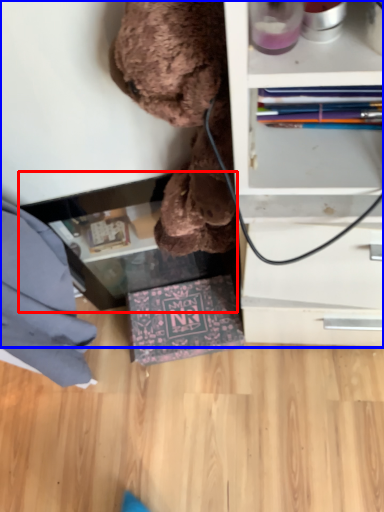
Question: Among these objects, which one is farthest to the camera, table (highlighted by a red box) or shelf (highlighted by a blue box)?

Choices:
 (A) table
 (B) shelf

Answer: (A)